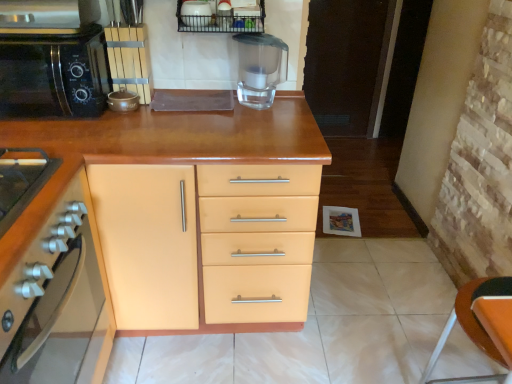
Question: Does black matte microwave at left have a lesser width compared to matte wood cabinet at center, which is the 1th cabinetry in back-to-front order?

Choices:
 (A) yes
 (B) no

Answer: (A)

Question: From the image's perspective, is black matte microwave at left located above matte wood cabinet at center, the 2th cabinetry when ordered from front to back?

Choices:
 (A) yes
 (B) no

Answer: (A)

Question: Is black matte microwave at left facing towards matte wood cabinet at center, which is the 1th cabinetry in back-to-front order?

Choices:
 (A) no
 (B) yes

Answer: (A)

Question: Can you confirm if black matte microwave at left is positioned to the left of matte wood cabinet at center, the 2th cabinetry when ordered from front to back?

Choices:
 (A) no
 (B) yes

Answer: (B)

Question: From the image's perspective, does black matte microwave at left appear lower than matte wood cabinet at center, which is the 1th cabinetry in back-to-front order?

Choices:
 (A) no
 (B) yes

Answer: (A)

Question: From a real-world perspective, is black matte microwave at left below matte wood cabinet at center, which is the 1th cabinetry in back-to-front order?

Choices:
 (A) no
 (B) yes

Answer: (A)

Question: Does metallic wire basket at upper center have a greater width compared to matte wood cabinet at center, which is the 1th cabinetry in back-to-front order?

Choices:
 (A) no
 (B) yes

Answer: (A)

Question: Can you confirm if metallic wire basket at upper center is positioned to the left of matte wood cabinet at center, the 2th cabinetry when ordered from front to back?

Choices:
 (A) yes
 (B) no

Answer: (B)

Question: Does metallic wire basket at upper center have a smaller size compared to matte wood cabinet at center, which is the 1th cabinetry in back-to-front order?

Choices:
 (A) yes
 (B) no

Answer: (A)

Question: Can you confirm if metallic wire basket at upper center is thinner than matte wood cabinet at center, which is the 1th cabinetry in back-to-front order?

Choices:
 (A) yes
 (B) no

Answer: (A)

Question: From the image's perspective, is metallic wire basket at upper center above matte wood cabinet at center, which is the 1th cabinetry in back-to-front order?

Choices:
 (A) yes
 (B) no

Answer: (A)

Question: Can you confirm if metallic wire basket at upper center is shorter than matte wood cabinet at center, the 2th cabinetry when ordered from front to back?

Choices:
 (A) no
 (B) yes

Answer: (B)

Question: Considering the relative sizes of white glossy bowl at upper center, positioned as the 1th appliance in top-to-bottom order, and metallic wire basket at upper center in the image provided, is white glossy bowl at upper center, positioned as the 1th appliance in top-to-bottom order, taller than metallic wire basket at upper center?

Choices:
 (A) yes
 (B) no

Answer: (A)